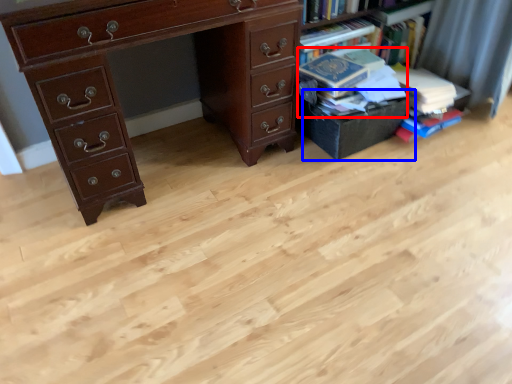
Question: Which object appears farthest to the camera in this image, book (highlighted by a red box) or drawer (highlighted by a blue box)?

Choices:
 (A) book
 (B) drawer

Answer: (B)